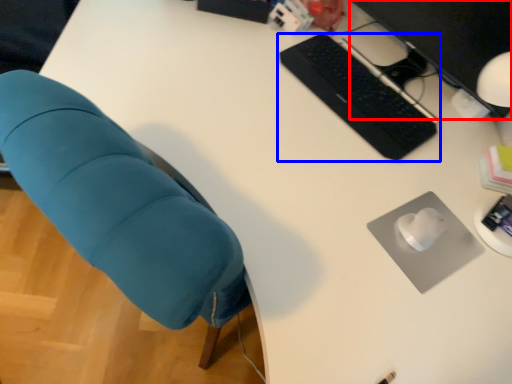
Question: Among these objects, which one is nearest to the camera, computer monitor (highlighted by a red box) or computer keyboard (highlighted by a blue box)?

Choices:
 (A) computer monitor
 (B) computer keyboard

Answer: (A)